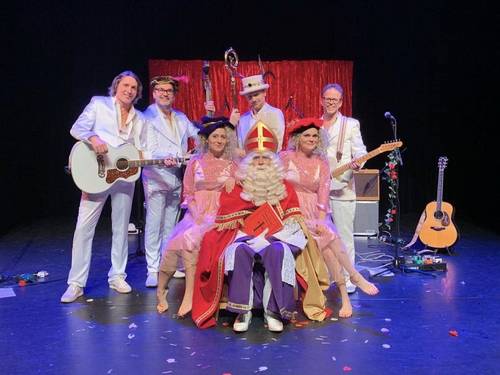
Find the location of `red curtain`. red curtain is located at coordinates (321, 80).